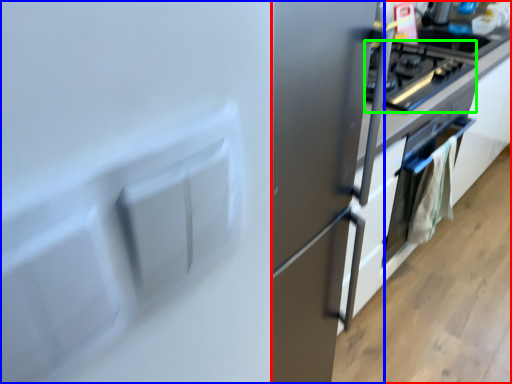
Question: Which object is the closest to the cabinetry (highlighted by a red box)? Choose among these: fridge (highlighted by a blue box) or home appliance (highlighted by a green box).

Choices:
 (A) fridge
 (B) home appliance

Answer: (A)